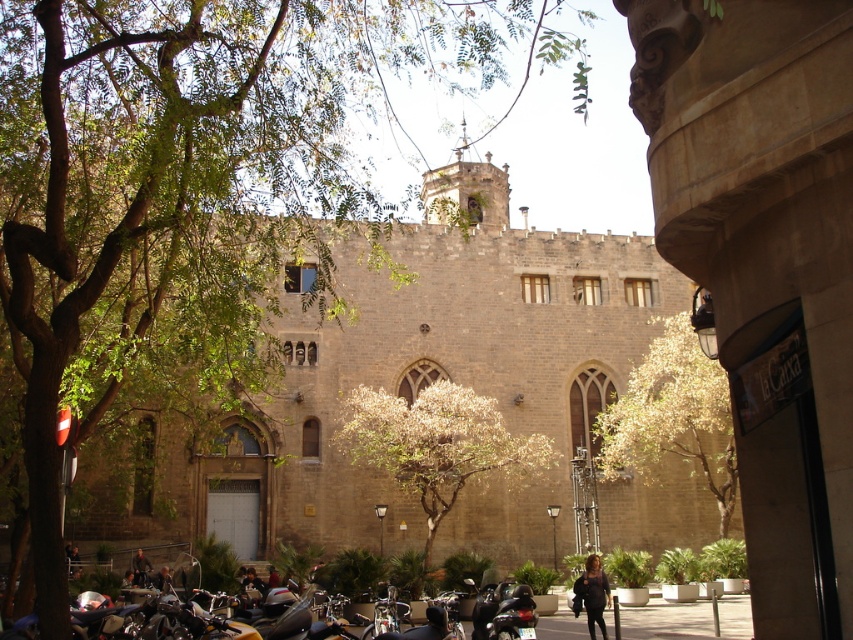
Question: Is green leafy tree at upper left to the left of shiny black motorcycle at lower center from the viewer's perspective?

Choices:
 (A) yes
 (B) no

Answer: (A)

Question: Can you confirm if green leafy tree at center is thinner than shiny black motorcycle at lower center?

Choices:
 (A) no
 (B) yes

Answer: (A)

Question: Which point is farther from the camera taking this photo?

Choices:
 (A) (173, 74)
 (B) (683, 410)

Answer: (B)

Question: Among these objects, which one is farthest from the camera?

Choices:
 (A) green leafy tree at center
 (B) golden textured tree at center

Answer: (A)

Question: Estimate the real-world distances between objects in this image. Which object is farther from the shiny black motorcycle at lower center?

Choices:
 (A) golden textured tree at center
 (B) green leafy tree at center
 (C) green leafy tree at upper left

Answer: (C)

Question: Is green leafy tree at upper left closer to the viewer compared to green leafy tree at center?

Choices:
 (A) no
 (B) yes

Answer: (B)